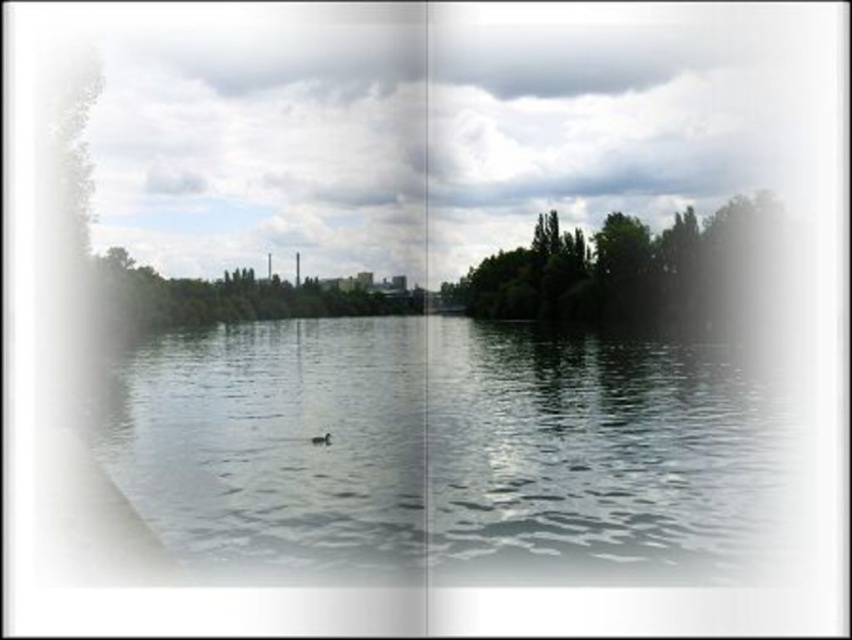
Is point (764, 296) closer to camera compared to point (318, 444)?

No, (764, 296) is behind (318, 444).

Does green leafy trees at center appear on the left side of brown matte duck at center?

In fact, green leafy trees at center is to the right of brown matte duck at center.

Identify the location of green leafy trees at center. click(x=634, y=272).

Between green leafy trees at center and green leafy tree at center, which one appears on the left side from the viewer's perspective?

green leafy tree at center is more to the left.

Between green leafy trees at center and green leafy tree at center, which one has less height?

With less height is green leafy tree at center.

Which is behind, point (645, 324) or point (285, 282)?

Point (285, 282)

Locate an element on the screen. This screenshot has width=852, height=640. green leafy trees at center is located at coordinates (634, 272).

Is clear water at center thinner than green leafy trees at center?

In fact, clear water at center might be wider than green leafy trees at center.

In the scene shown: Is clear water at center taller than green leafy trees at center?

In fact, clear water at center may be shorter than green leafy trees at center.

Locate an element on the screen. This screenshot has width=852, height=640. clear water at center is located at coordinates (458, 452).